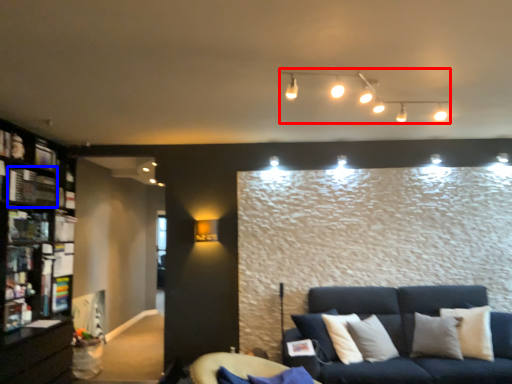
Question: Which point is further to the camera, lamp (highlighted by a red box) or shelf (highlighted by a blue box)?

Choices:
 (A) lamp
 (B) shelf

Answer: (B)